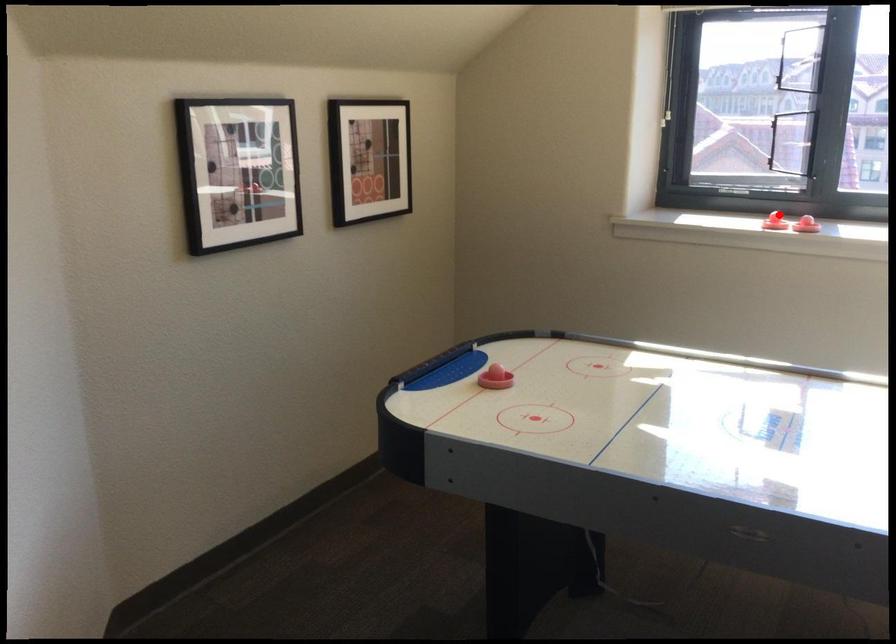
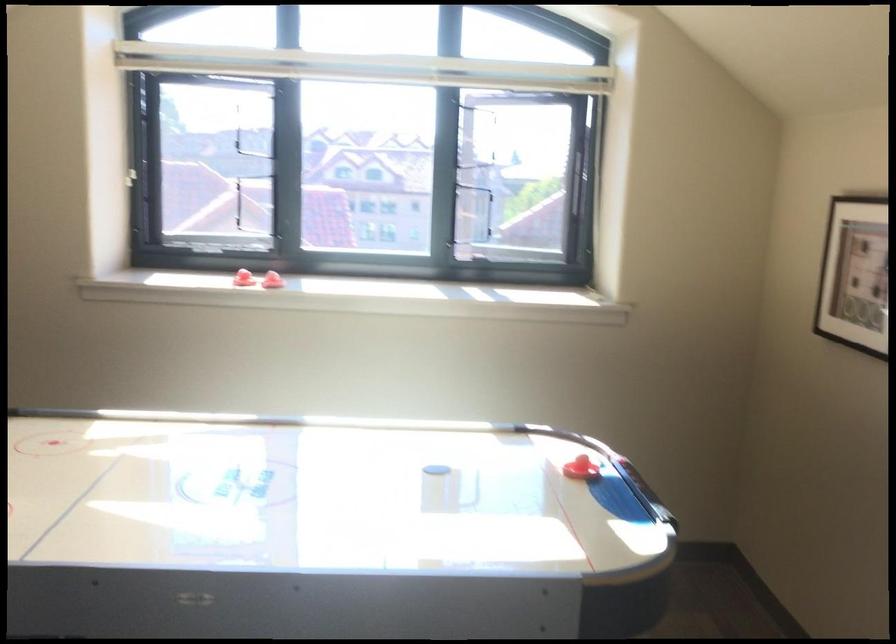
Question: I am providing you with two images of the same scene from different viewpoints. A red point is marked on the first image. Can you still see the location of the red point in image 2?

Choices:
 (A) Yes
 (B) No

Answer: (A)